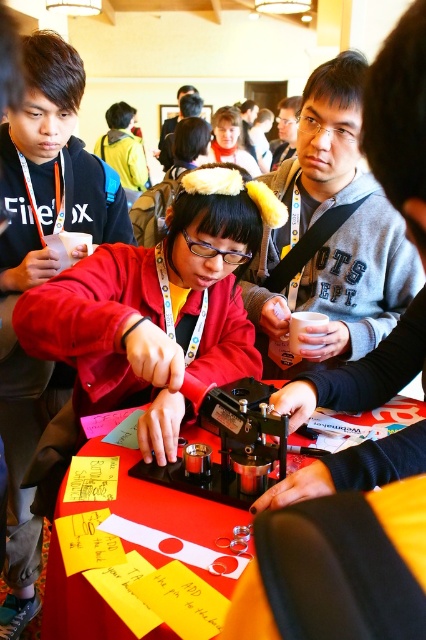
Question: Is gray fleece sweatshirt at center smaller than red plastic table at center?

Choices:
 (A) no
 (B) yes

Answer: (A)

Question: Based on their relative distances, which object is farther from the matte black shirt at center?

Choices:
 (A) matte red jacket at center
 (B) red plastic table at center

Answer: (B)

Question: Which is nearer to the matte black shirt at center?

Choices:
 (A) red plastic table at center
 (B) gray fleece sweatshirt at center

Answer: (B)

Question: Can you confirm if gray fleece sweatshirt at center is bigger than red plastic table at center?

Choices:
 (A) yes
 (B) no

Answer: (A)

Question: Can you confirm if matte red jacket at center is positioned above matte black shirt at center?

Choices:
 (A) yes
 (B) no

Answer: (B)

Question: Which is farther from the matte black shirt at center?

Choices:
 (A) red plastic table at center
 (B) matte red jacket at center

Answer: (A)